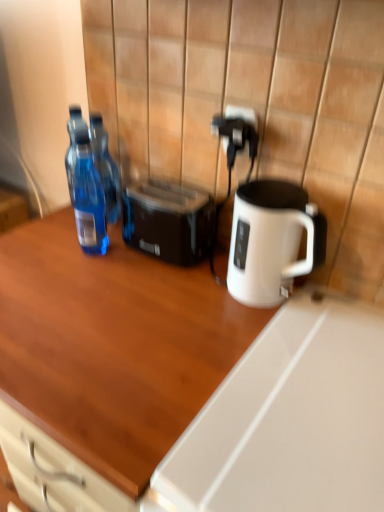
This screenshot has width=384, height=512. In order to click on vacant area to the right of transparent plastic bottle at left, the 1th bottle positioned from the front in this screenshot , I will do `click(164, 267)`.